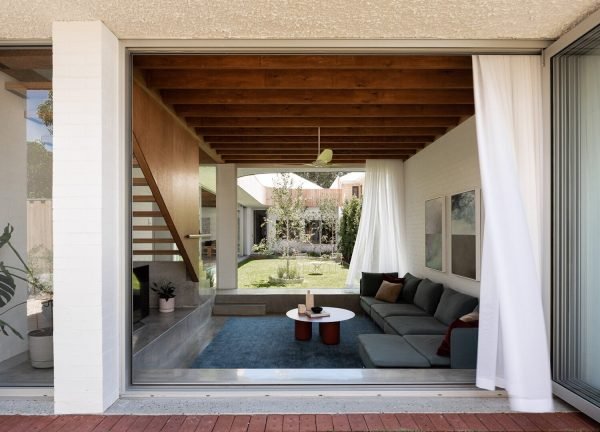
Locate an element on the screen. area rug is located at coordinates (260, 351).